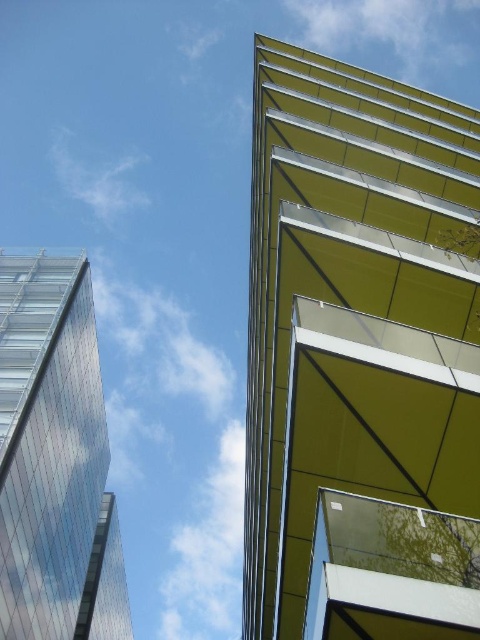
Does yellow glass building at upper right lie in front of transparent glass building at left?

Yes, it is.

Which is more to the right, yellow glass building at upper right or transparent glass building at left?

yellow glass building at upper right

Who is more forward, (370, 180) or (45, 476)?

Point (370, 180) is more forward.

I want to click on yellow glass building at upper right, so click(360, 356).